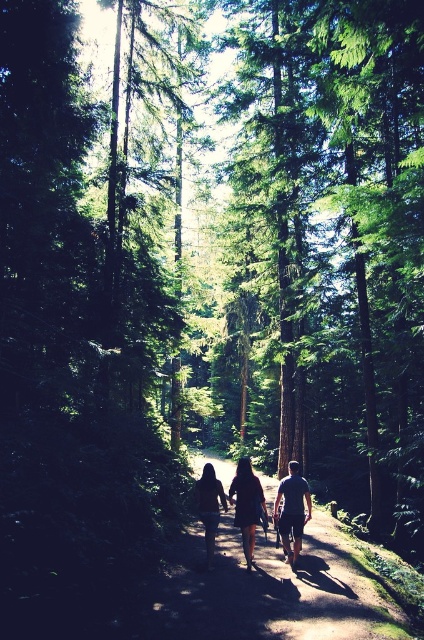
You are standing at the starting point of the forest path and see two points marked on the dirt path ahead. The first point is at coordinates point (248, 556) and the second point is at point (225, 500). Which point is closer to you?

Point (248, 556) is closer to the viewer than point (225, 500).

You are standing at the point with coordinates (x=247, y=506) in the forest scene. What object is located exactly at this coordinate?

The point at coordinates (x=247, y=506) corresponds to the dark brown leather backpack at center.

You are a hiker who wants to carry both the dark brown leather backpack at center and the dark brown leather jacket at center on your narrow hiking trail. Since the backpack is wider, will it be harder to navigate through the narrow path compared to the jacket?

The dark brown leather backpack at center is wider than the dark brown leather jacket at center, so it will be harder to navigate through the narrow path with the backpack compared to the jacket.